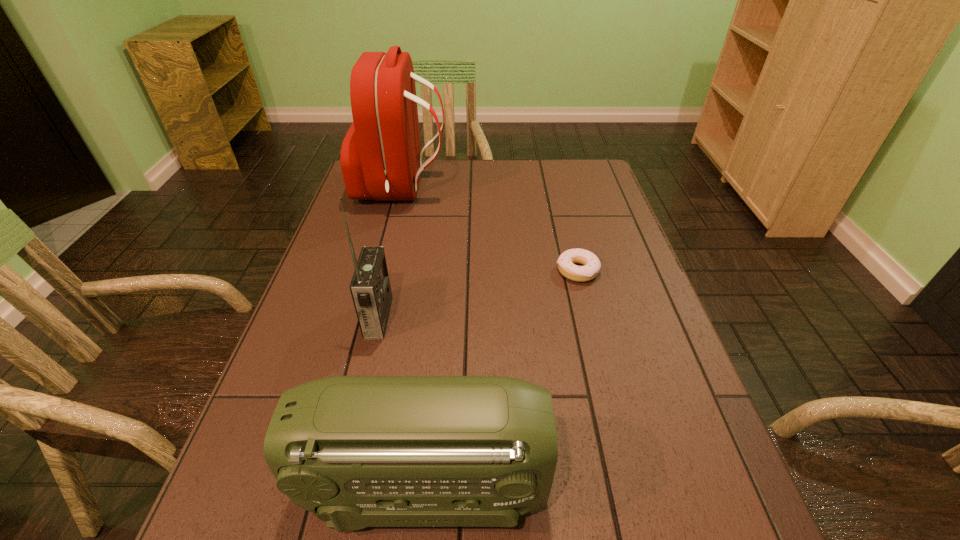
The height and width of the screenshot is (540, 960). In order to click on vacant area that lies between the backpack and the rightmost object in this screenshot , I will do `click(490, 230)`.

You are a GUI agent. You are given a task and a screenshot of the screen. Output one action in this format:
    pyautogui.click(x=<x>, y=<y>)
    Task: Click on the free area in between the second nearest object and the doughnut
    
    Given the screenshot: What is the action you would take?
    pyautogui.click(x=478, y=294)

The width and height of the screenshot is (960, 540). Find the location of `the third closest object to the nearest object`. the third closest object to the nearest object is located at coordinates (380, 157).

Where is `object that ranks as the second closest to the third nearest object`? This screenshot has height=540, width=960. object that ranks as the second closest to the third nearest object is located at coordinates (370, 288).

I want to click on free location that satisfies the following two spatial constraints: 1. on the strap side of the backpack; 2. on the back side of the rightmost object, so click(381, 271).

At what (x,y) coordinates should I click in order to perform the action: click on vacant area that satisfies the following two spatial constraints: 1. on the strap side of the farthest object; 2. on the right side of the doughnut. Please return your answer as a coordinate pair (x, y). Looking at the image, I should click on (381, 271).

This screenshot has height=540, width=960. I want to click on free space that satisfies the following two spatial constraints: 1. on the strap side of the farthest object; 2. on the back side of the doughnut, so click(381, 271).

At what (x,y) coordinates should I click in order to perform the action: click on blank space that satisfies the following two spatial constraints: 1. on the strap side of the rightmost object; 2. on the right side of the tallest object. Please return your answer as a coordinate pair (x, y). The width and height of the screenshot is (960, 540). Looking at the image, I should click on (381, 271).